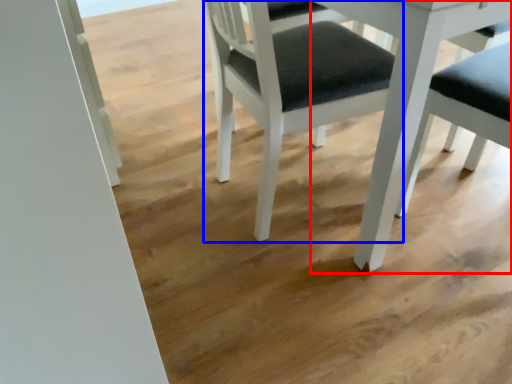
Question: Which point is further to the camera, table (highlighted by a red box) or chair (highlighted by a blue box)?

Choices:
 (A) table
 (B) chair

Answer: (B)